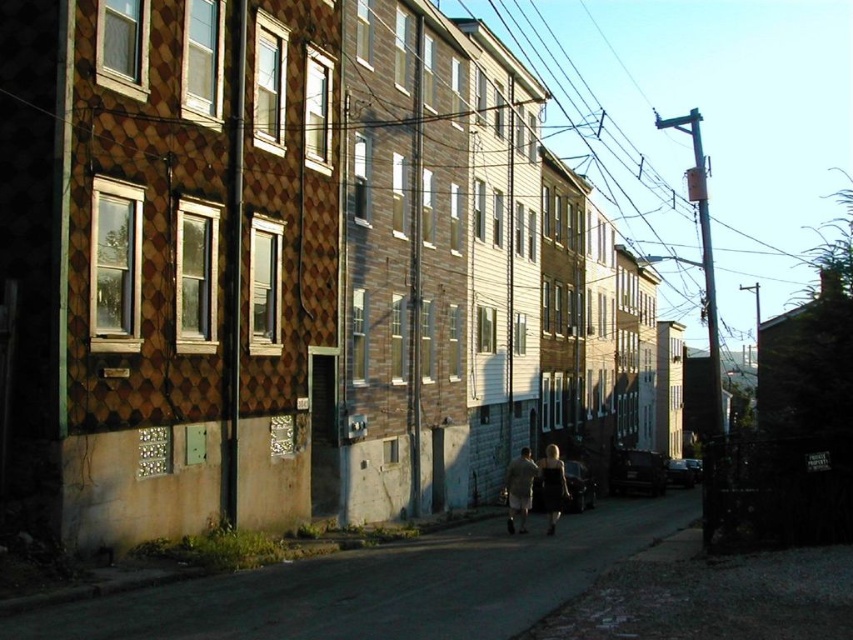
Between smooth concrete alley at center and matte black dress at center, which one has more height?

Standing taller between the two is matte black dress at center.

Who is shorter, smooth concrete alley at center or matte black dress at center?

smooth concrete alley at center

Which is in front, point (389, 579) or point (547, 493)?

Point (389, 579) is in front.

At what (x,y) coordinates should I click in order to perform the action: click on smooth concrete alley at center. Please return your answer as a coordinate pair (x, y). This screenshot has width=853, height=640. Looking at the image, I should click on (383, 586).

Is light brown fabric pants at center in front of matte black dress at center?

Yes.

Does light brown fabric pants at center appear under matte black dress at center?

No.

Between point (521, 516) and point (547, 515), which one is positioned behind?

The point (547, 515) is behind.

The width and height of the screenshot is (853, 640). Find the location of `light brown fabric pants at center`. light brown fabric pants at center is located at coordinates (519, 490).

Can you confirm if smooth concrete alley at center is taller than light brown fabric pants at center?

No.

Who is taller, smooth concrete alley at center or light brown fabric pants at center?

With more height is light brown fabric pants at center.

The width and height of the screenshot is (853, 640). I want to click on smooth concrete alley at center, so click(383, 586).